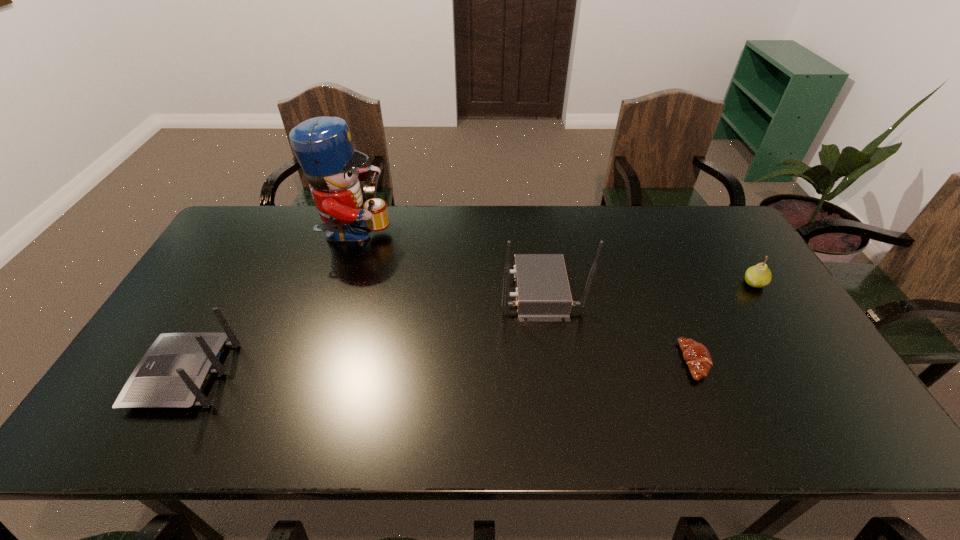
In order to click on vacant space that satisfies the following two spatial constraints: 1. on the back of the right router to connect cables; 2. on the left side of the shortest object in this screenshot , I will do `click(550, 361)`.

At what (x,y) coordinates should I click in order to perform the action: click on blank area in the image that satisfies the following two spatial constraints: 1. on the front-facing side of the rightmost object; 2. on the right side of the nutcracker. Please return your answer as a coordinate pair (x, y). This screenshot has width=960, height=540. Looking at the image, I should click on (339, 284).

The width and height of the screenshot is (960, 540). I want to click on vacant position in the image that satisfies the following two spatial constraints: 1. on the back of the third object from right to left to connect cables; 2. on the back side of the shortest object, so click(x=550, y=361).

Where is `vacant space that satisfies the following two spatial constraints: 1. on the front side of the shortest object; 2. on the front-facing side of the nearer router`? Image resolution: width=960 pixels, height=540 pixels. vacant space that satisfies the following two spatial constraints: 1. on the front side of the shortest object; 2. on the front-facing side of the nearer router is located at coordinates (700, 374).

This screenshot has height=540, width=960. What are the coordinates of `vacant space that satisfies the following two spatial constraints: 1. on the front-facing side of the fourth object from right to left; 2. on the right side of the crescent roll` in the screenshot? It's located at (314, 361).